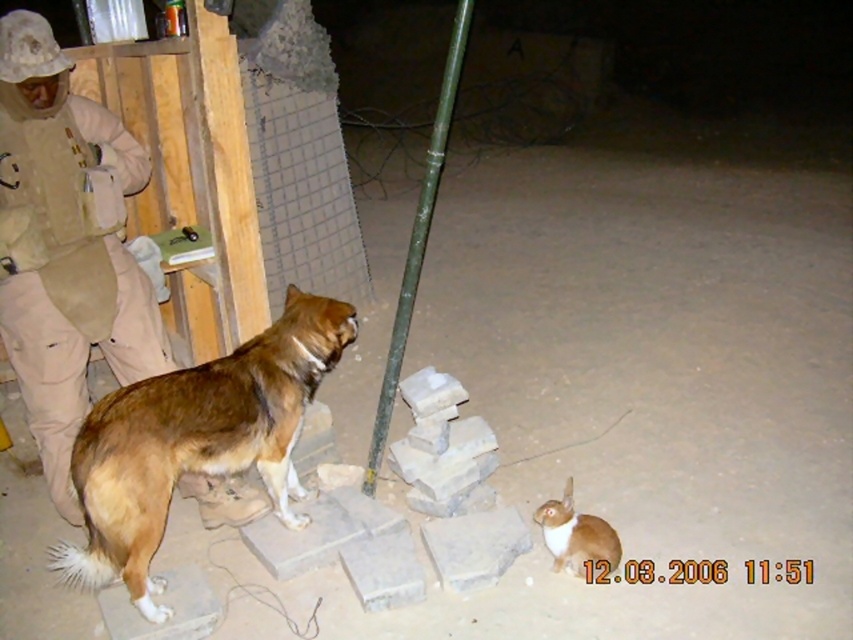
Question: Is tan/khaki uniform at left behind green painted wood pole at center?

Choices:
 (A) yes
 (B) no

Answer: (B)

Question: Is green painted wood pole at center to the right of orange fur cat at lower right from the viewer's perspective?

Choices:
 (A) no
 (B) yes

Answer: (A)

Question: Considering the relative positions of tan/khaki uniform at left and green painted wood pole at center in the image provided, where is tan/khaki uniform at left located with respect to green painted wood pole at center?

Choices:
 (A) below
 (B) above

Answer: (A)

Question: Based on their relative distances, which object is nearer to the brown furry dog at left?

Choices:
 (A) orange fur cat at lower right
 (B) green painted wood pole at center
 (C) tan/khaki uniform at left

Answer: (C)

Question: Which is farther from the green painted wood pole at center?

Choices:
 (A) tan/khaki uniform at left
 (B) orange fur cat at lower right
 (C) brown furry dog at left

Answer: (A)

Question: Which point appears closest to the camera in this image?

Choices:
 (A) (210, 444)
 (B) (572, 516)

Answer: (A)